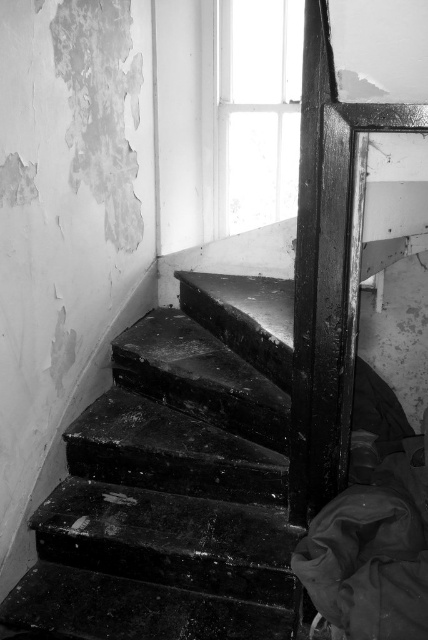
Question: Which of the following is the closest to the observer?

Choices:
 (A) (130, 616)
 (B) (270, 188)

Answer: (A)

Question: Does black glossy stairs at center lie behind transparent glass window at upper center?

Choices:
 (A) yes
 (B) no

Answer: (B)

Question: Can you confirm if black glossy stairs at center is smaller than transparent glass window at upper center?

Choices:
 (A) yes
 (B) no

Answer: (B)

Question: Can you confirm if black glossy stairs at center is positioned to the left of transparent glass window at upper center?

Choices:
 (A) no
 (B) yes

Answer: (B)

Question: Which point is farther from the camera taking this photo?

Choices:
 (A) (97, 461)
 (B) (296, 113)

Answer: (B)